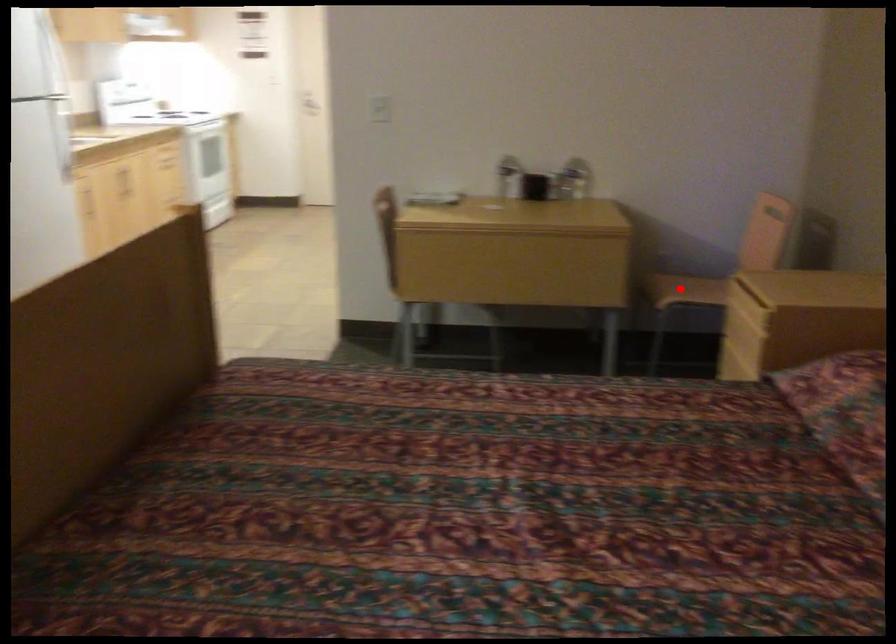
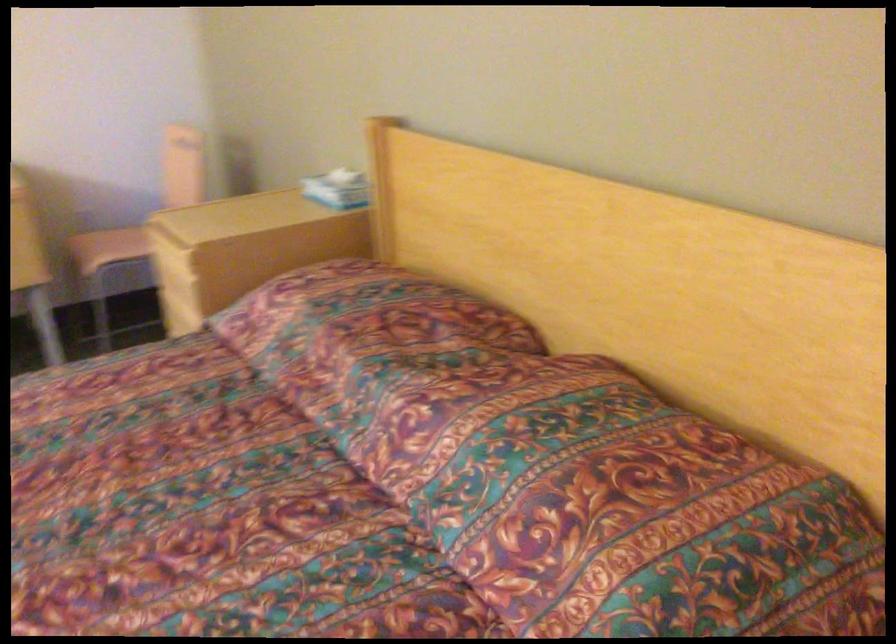
Question: A red point is marked in image1. In image2, is the corresponding 3D point closer to the camera or farther? Reply with the corresponding letter.

Choices:
 (A) The corresponding 3D point is closer.
 (B) The corresponding 3D point is farther.

Answer: (A)